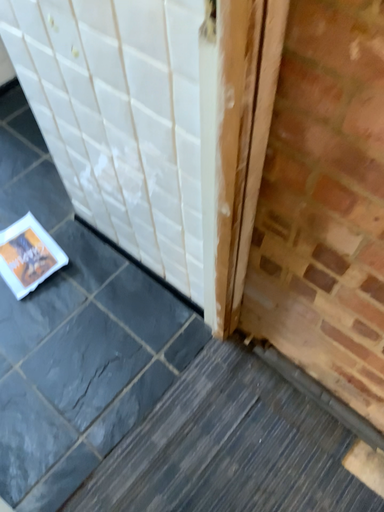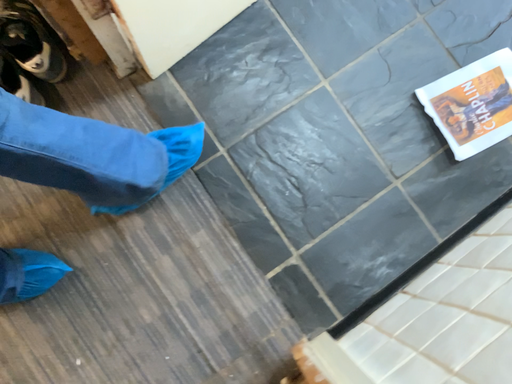
Question: How did the camera likely rotate when shooting the video?

Choices:
 (A) rotated downward
 (B) rotated upward

Answer: (B)